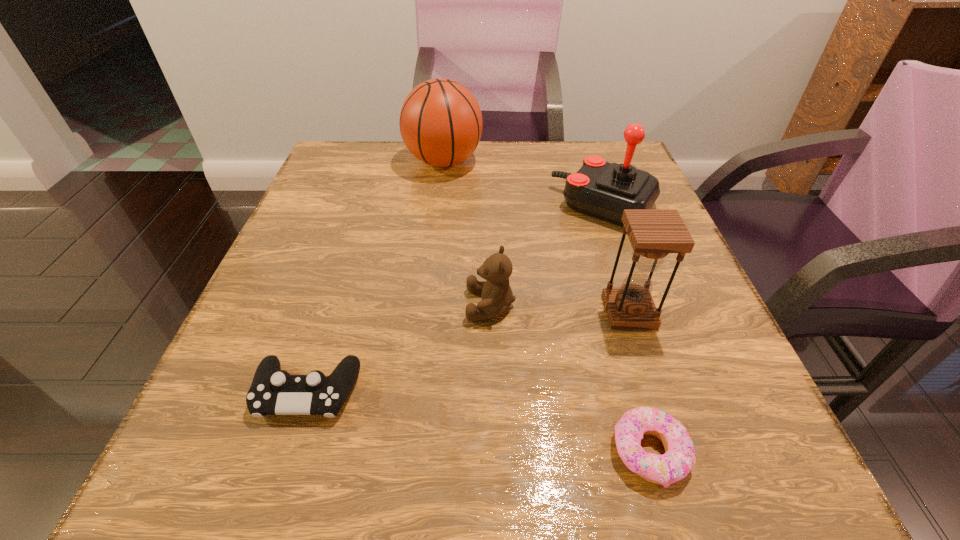
Locate an element on the screen. The width and height of the screenshot is (960, 540). basketball is located at coordinates (441, 123).

Locate an element on the screen. joystick is located at coordinates (604, 190).

You are a GUI agent. You are given a task and a screenshot of the screen. Output one action in this format:
    pyautogui.click(x=<x>, y=<y>)
    Task: Click on the hourglass
    The width and height of the screenshot is (960, 540).
    Given the screenshot: What is the action you would take?
    pyautogui.click(x=653, y=233)

I want to click on teddy bear, so click(x=497, y=296).

In order to click on control in this screenshot , I will do `click(273, 391)`.

Identify the location of the shortest object. Image resolution: width=960 pixels, height=540 pixels. (679, 459).

Identify the location of vacant space located 0.090m on the left of the basketball. (369, 162).

Find the location of a particular element. Image resolution: width=960 pixels, height=540 pixels. free location located on the front of the joystick is located at coordinates (626, 267).

Find the location of a particular element. free space located 0.120m on the left of the hourglass is located at coordinates (534, 312).

The image size is (960, 540). I want to click on free point located 0.290m on the front-facing side of the third shortest object, so click(x=296, y=305).